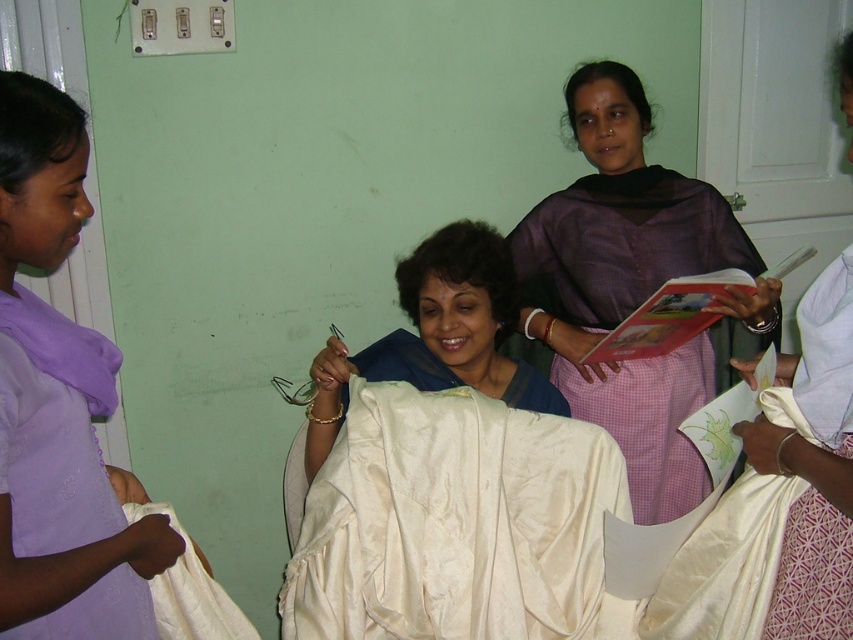
Question: Does purple satin scarf at left have a lesser width compared to satin white saree at center?

Choices:
 (A) yes
 (B) no

Answer: (A)

Question: Which point is farther to the camera?

Choices:
 (A) white satin cloth at right
 (B) satin white saree at center

Answer: (B)

Question: Which point is farther to the camera?

Choices:
 (A) white satin cloth at right
 (B) white silk cloth at center
 (C) satin white saree at center

Answer: (C)

Question: Considering the real-world distances, which object is closest to the purple satin scarf at left?

Choices:
 (A) white satin cloth at right
 (B) purple silk saree at upper right

Answer: (A)

Question: Is white silk cloth at center to the right of white satin cloth at right from the viewer's perspective?

Choices:
 (A) no
 (B) yes

Answer: (A)

Question: Can you confirm if purple satin scarf at left is bigger than white satin cloth at right?

Choices:
 (A) yes
 (B) no

Answer: (B)